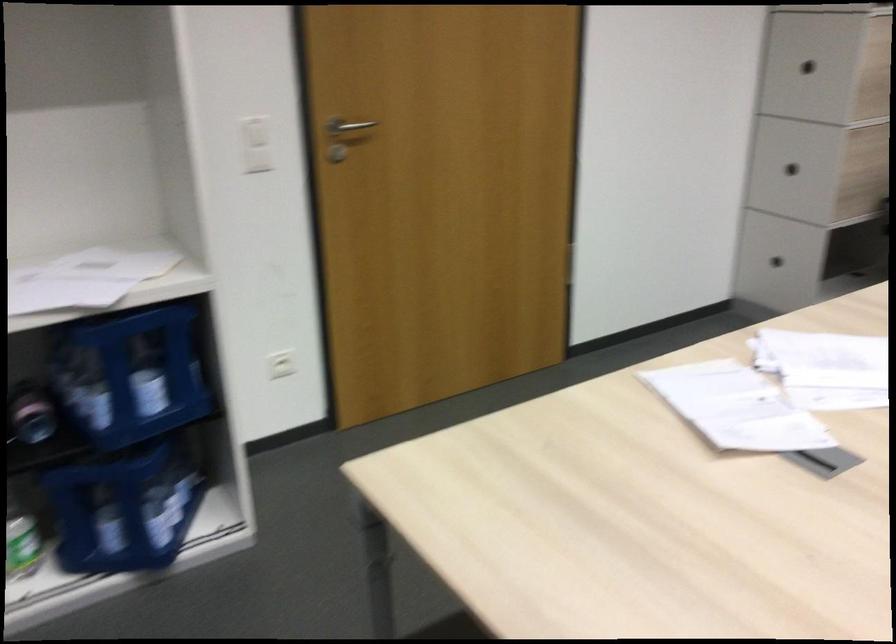
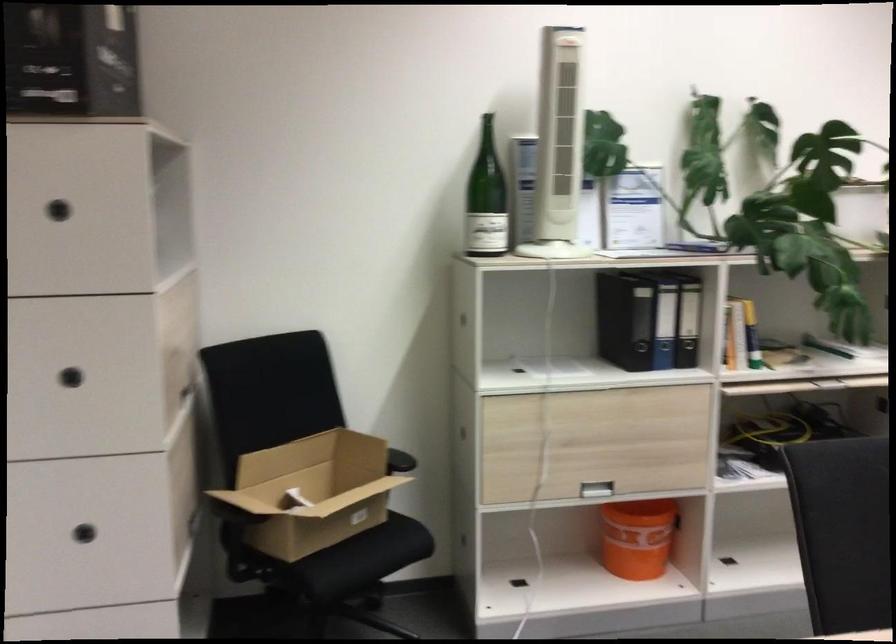
Where in the second image is the point corresponding to pixel 784 172 from the first image?

(83, 534)